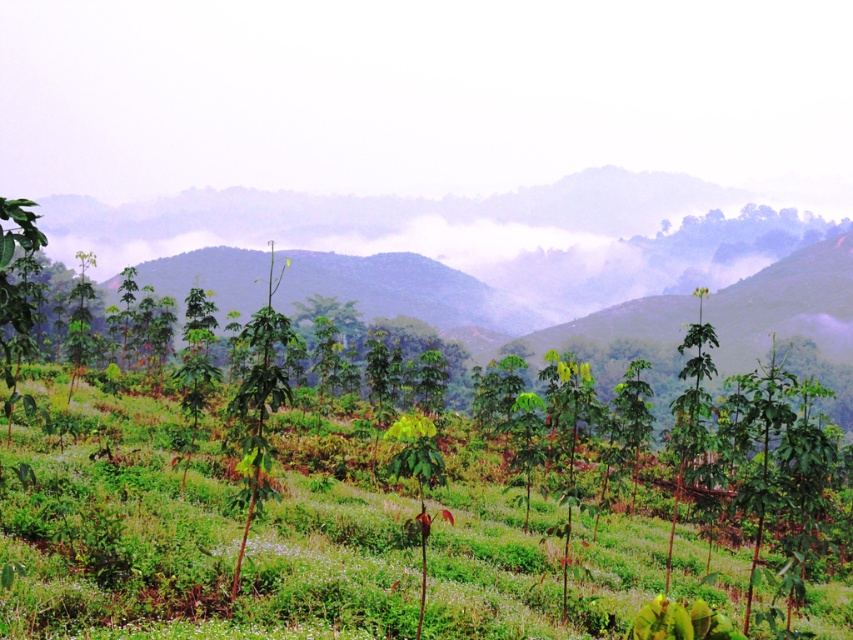
Between green leafy grass at center and green leafy tree at center, which one has more height?

green leafy tree at center

Who is higher up, green leafy grass at center or green leafy tree at center?

green leafy tree at center

Between point (160, 400) and point (254, 330), which one is positioned in front?

Point (254, 330)

This screenshot has width=853, height=640. Identify the location of green leafy grass at center. (322, 540).